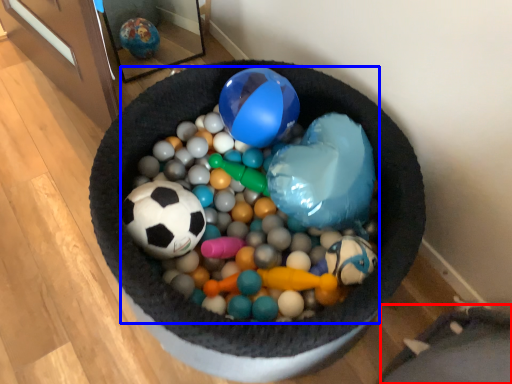
Question: Which point is further to the camera, bean bag chair (highlighted by a red box) or ball (highlighted by a blue box)?

Choices:
 (A) bean bag chair
 (B) ball

Answer: (A)